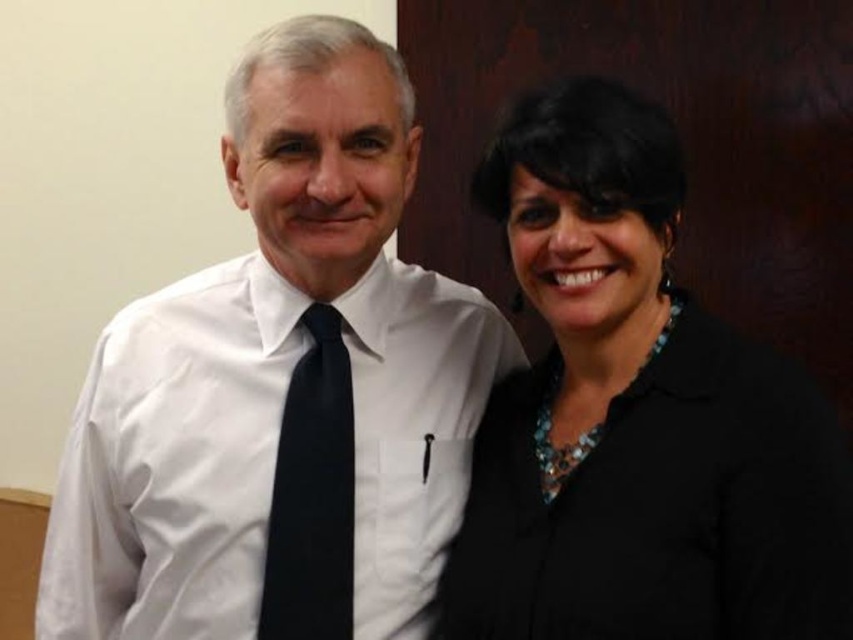
Consider the image. You are a tailor measuring the distance between two items in the image. The black matte blazer at right and the black satin tie at center are both on a mannequin. The tailor needs to ensure there is at least 12 inches of space between them for proper display. Does the current distance meet the requirement?

The black matte blazer at right is 12.26 inches from the black satin tie at center, which exceeds the required 12 inches, so the current distance meets the requirement.

You are organizing a charity event and need to display a white satin shirt at left and a black satin tie at center on a small mannequin. The mannequin can only accommodate one item due to space constraints. Based on their sizes, which item should you choose to display?

The white satin shirt at left is bigger than the black satin tie at center, so you should choose the white satin shirt at left to display since it requires more space and the mannequin can only accommodate one item.